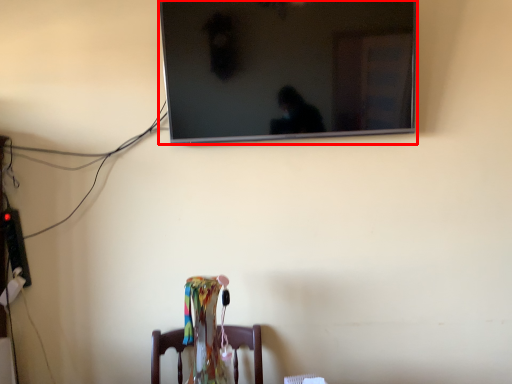
Question: Considering the relative positions of television (annotated by the red box) and furniture in the image provided, where is television (annotated by the red box) located with respect to the staircase?

Choices:
 (A) left
 (B) right

Answer: (B)